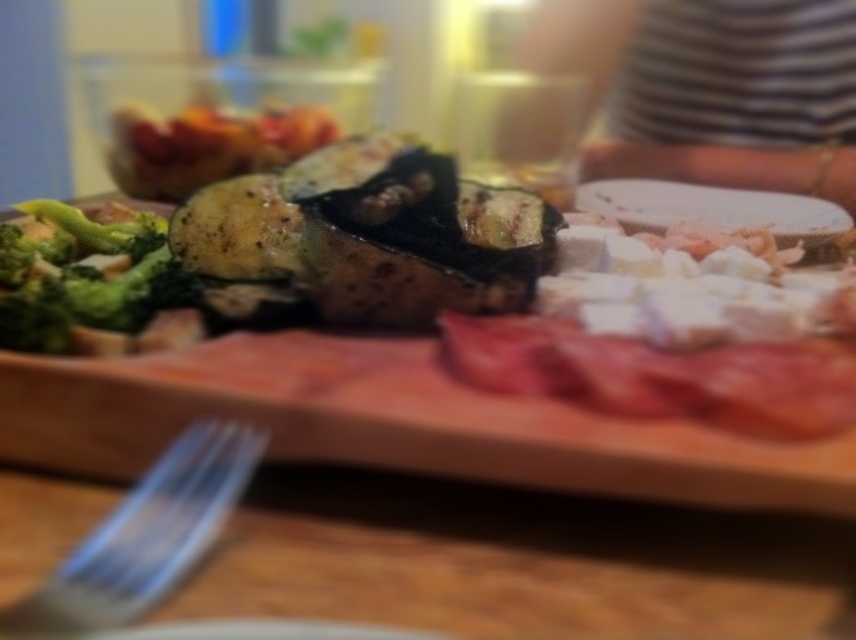
You are looking at the wooden serving board from above. There are two points marked on the board at coordinates point (204, 513) and point (79, 320). Which point is closer to you?

Point (204, 513) is in front of point (79, 320), so it is closer to you.

You are arranging a buffet table and need to know the spatial relationship between the grilled eggplant at center and the green matte broccoli at left. Which one is placed above the other?

The grilled eggplant at center is positioned over green matte broccoli at left.

You are a food critic who wants to taste the grilled vegetables on the left side of the wooden serving board. You have a silver metallic fork at lower left located at point (147, 532). Can you reach the grilled vegetables with the silver metallic fork at lower left without moving the fork?

The silver metallic fork at lower left is located at point (147, 532). Since the grilled vegetables are on the left side of the board and the fork is also at the lower left, it is likely within reach. Therefore, yes, you can reach the grilled vegetables with the silver metallic fork at lower left without moving the fork.